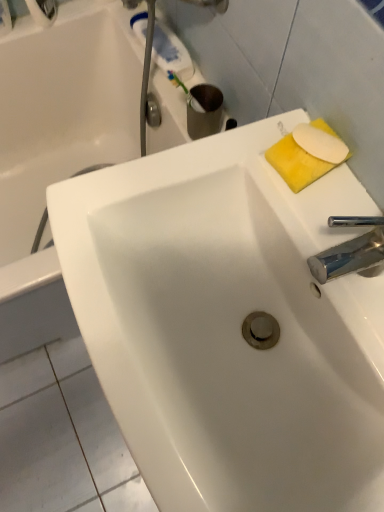
Question: Does white glossy bathtub at upper left have a lesser width compared to white glossy sink at center?

Choices:
 (A) no
 (B) yes

Answer: (A)

Question: Is white glossy bathtub at upper left far away from white glossy sink at center?

Choices:
 (A) no
 (B) yes

Answer: (A)

Question: Can you confirm if white glossy bathtub at upper left is smaller than white glossy sink at center?

Choices:
 (A) no
 (B) yes

Answer: (A)

Question: Is white glossy bathtub at upper left looking in the opposite direction of white glossy sink at center?

Choices:
 (A) yes
 (B) no

Answer: (B)

Question: Are white glossy bathtub at upper left and white glossy sink at center making contact?

Choices:
 (A) no
 (B) yes

Answer: (A)

Question: Is white glossy bathtub at upper left positioned behind white glossy sink at center?

Choices:
 (A) no
 (B) yes

Answer: (B)

Question: Is white matte soap at upper right, positioned as the 2th soap in back-to-front order, oriented away from yellow sponge at upper right, which ranks as the second soap in front-to-back order?

Choices:
 (A) yes
 (B) no

Answer: (B)

Question: Could you tell me if white matte soap at upper right, positioned as the first soap in front-to-back order, is turned towards yellow sponge at upper right, which ranks as the second soap in front-to-back order?

Choices:
 (A) no
 (B) yes

Answer: (A)

Question: Can you confirm if white matte soap at upper right, positioned as the first soap in front-to-back order, is bigger than yellow sponge at upper right, which ranks as the second soap in front-to-back order?

Choices:
 (A) no
 (B) yes

Answer: (A)

Question: Is white matte soap at upper right, positioned as the 2th soap in back-to-front order, shorter than yellow sponge at upper right, placed as the 1th soap when sorted from back to front?

Choices:
 (A) yes
 (B) no

Answer: (A)

Question: Would you consider white matte soap at upper right, positioned as the 2th soap in back-to-front order, to be distant from yellow sponge at upper right, which ranks as the second soap in front-to-back order?

Choices:
 (A) no
 (B) yes

Answer: (A)

Question: From a real-world perspective, is white matte soap at upper right, positioned as the 2th soap in back-to-front order, under yellow sponge at upper right, placed as the 1th soap when sorted from back to front?

Choices:
 (A) no
 (B) yes

Answer: (A)

Question: Is white glossy sink at center not inside white matte soap at upper right, positioned as the first soap in front-to-back order?

Choices:
 (A) yes
 (B) no

Answer: (A)